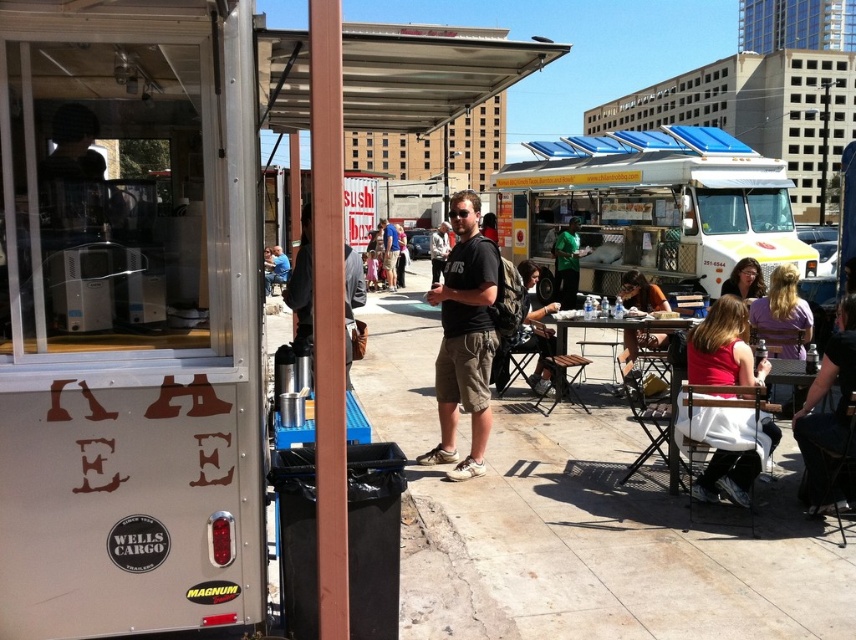
You are a photographer positioned at the back of the scene. You need to capture both the matte pink shirt at lower right and the dark gray backpack at center in a single frame. Which object should you adjust your camera angle to prioritize to ensure both are fully visible?

Since the matte pink shirt at lower right is wider than the dark gray backpack at center, you should adjust your camera angle to prioritize framing the wider matte pink shirt at lower right first to ensure both objects fit within the shot.

You are a photographer standing in front of the beige food truck with RAE written on its side. You notice a matte pink shirt at lower right and a dark gray backpack at center. Which object is closer to the ground?

The matte pink shirt at lower right is positioned under dark gray backpack at center, so the matte pink shirt at lower right is closer to the ground.